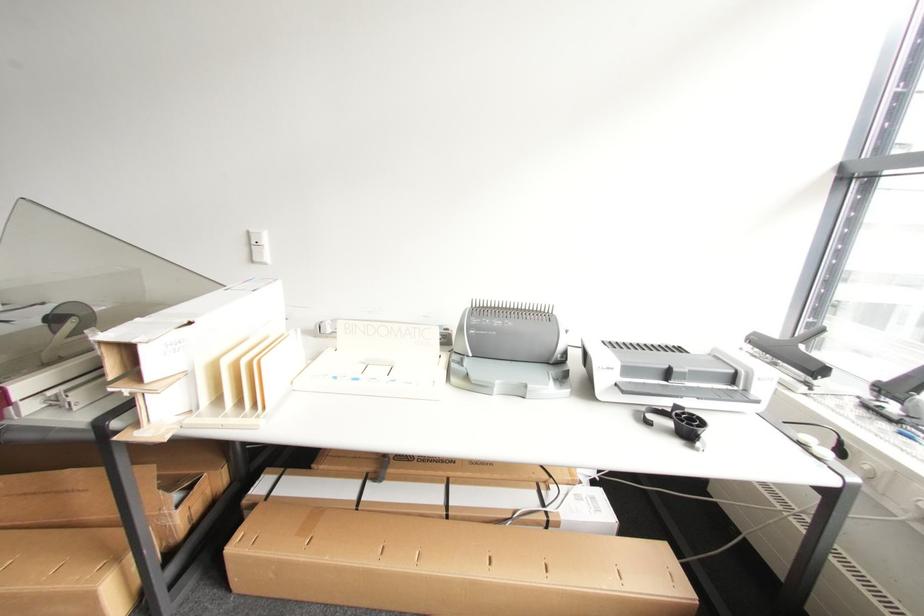
What do you see at coordinates (261, 254) in the screenshot? The height and width of the screenshot is (616, 924). I see `a white light switch` at bounding box center [261, 254].